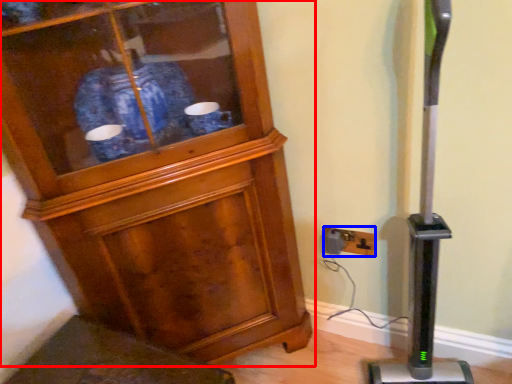
Question: Which of the following is the closest to the observer, cupboard (highlighted by a red box) or electric outlet (highlighted by a blue box)?

Choices:
 (A) cupboard
 (B) electric outlet

Answer: (A)